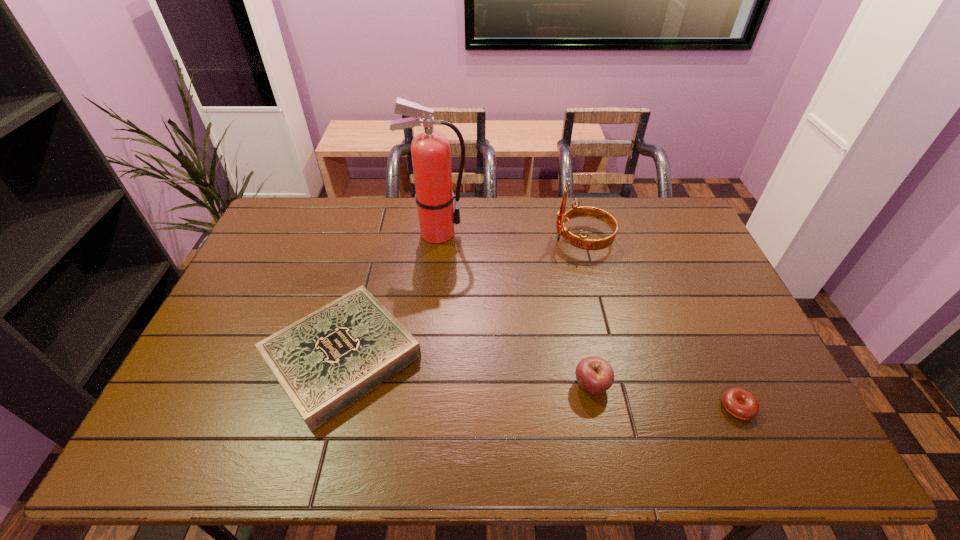
Where is `the tallest object`? The image size is (960, 540). the tallest object is located at coordinates (431, 156).

I want to click on the second tallest object, so click(580, 242).

This screenshot has width=960, height=540. Find the location of `apple`. apple is located at coordinates (595, 375).

The height and width of the screenshot is (540, 960). Identify the location of the fourth tallest object. (324, 362).

The width and height of the screenshot is (960, 540). In order to click on the shortest object in this screenshot , I will do `click(748, 408)`.

Identify the location of the rightmost object. (748, 408).

The image size is (960, 540). Identify the location of free region located 0.190m on the hose direction of the fire extinguisher. (520, 233).

This screenshot has width=960, height=540. Find the location of `vacant space located 0.390m on the front-facing side of the fourth shortest object`. vacant space located 0.390m on the front-facing side of the fourth shortest object is located at coordinates (442, 240).

Where is `free location located 0.310m on the front-facing side of the fourth shortest object`? This screenshot has height=540, width=960. free location located 0.310m on the front-facing side of the fourth shortest object is located at coordinates (465, 240).

Where is `free spot located on the front-facing side of the fourth shortest object`? Image resolution: width=960 pixels, height=540 pixels. free spot located on the front-facing side of the fourth shortest object is located at coordinates (510, 240).